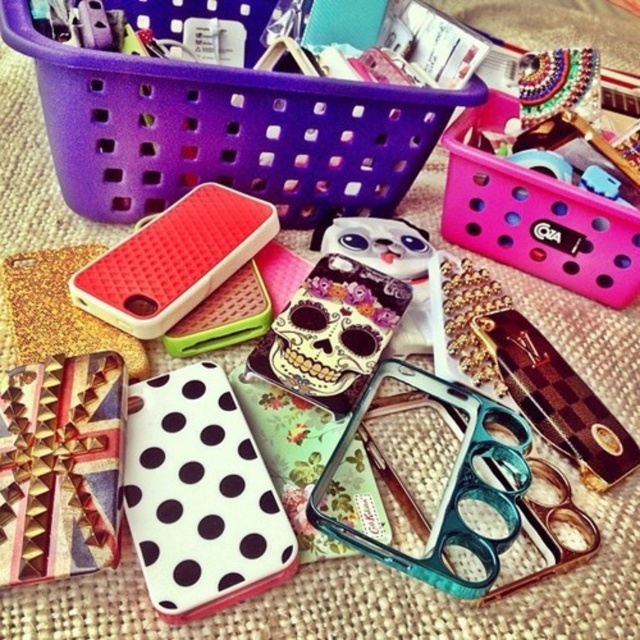
Question: Which object is positioned farthest from the purple plastic basket at upper left?

Choices:
 (A) matte skull case at center
 (B) pink plastic basket at upper right

Answer: (A)

Question: Which of the following is the farthest from the observer?

Choices:
 (A) (621, 285)
 (B) (371, 209)

Answer: (B)

Question: Which point appears closest to the camera in this image?

Choices:
 (A) click(596, 282)
 (B) click(342, 129)
 (C) click(298, 392)

Answer: (C)

Question: Is purple plastic basket at upper left bigger than pink plastic basket at upper right?

Choices:
 (A) no
 (B) yes

Answer: (B)

Question: Is pink plastic basket at upper right to the left of matte skull case at center from the viewer's perspective?

Choices:
 (A) yes
 (B) no

Answer: (B)

Question: Does purple plastic basket at upper left appear on the right side of matte skull case at center?

Choices:
 (A) no
 (B) yes

Answer: (A)